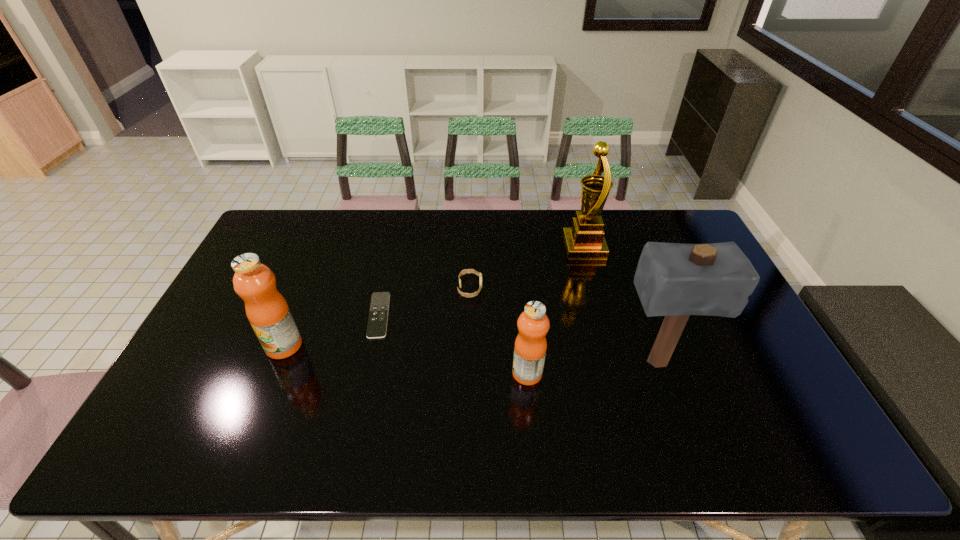
I want to click on free point that keeps the fruit juices evenly spaced on the right, so click(x=801, y=404).